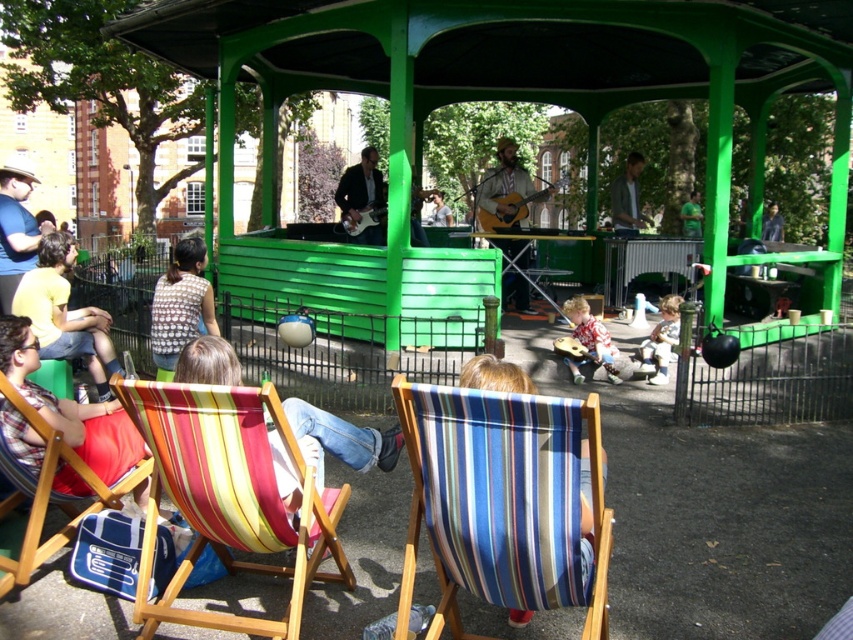
Between light brown wooden guitar at lower center and green matte shirt at center, which one has more height?

light brown wooden guitar at lower center

Does light brown wooden guitar at lower center appear on the left side of green matte shirt at center?

Indeed, light brown wooden guitar at lower center is positioned on the left side of green matte shirt at center.

Between point (654, 342) and point (693, 234), which one is positioned in front?

Point (654, 342) is in front.

The height and width of the screenshot is (640, 853). I want to click on light brown wooden guitar at lower center, so click(x=662, y=339).

Does matte blue shirt at left have a lesser width compared to smooth brown guitar at center?

No, matte blue shirt at left is not thinner than smooth brown guitar at center.

Who is positioned more to the right, matte blue shirt at left or smooth brown guitar at center?

From the viewer's perspective, smooth brown guitar at center appears more on the right side.

What are the coordinates of `matte blue shirt at left` in the screenshot? It's located at (16, 228).

Does light brown acoustic guitar at center lie behind matte black guitar at center?

No, light brown acoustic guitar at center is in front of matte black guitar at center.

Describe the element at coordinates (506, 186) in the screenshot. This screenshot has width=853, height=640. I see `light brown acoustic guitar at center` at that location.

The image size is (853, 640). Identify the location of light brown acoustic guitar at center. (506, 186).